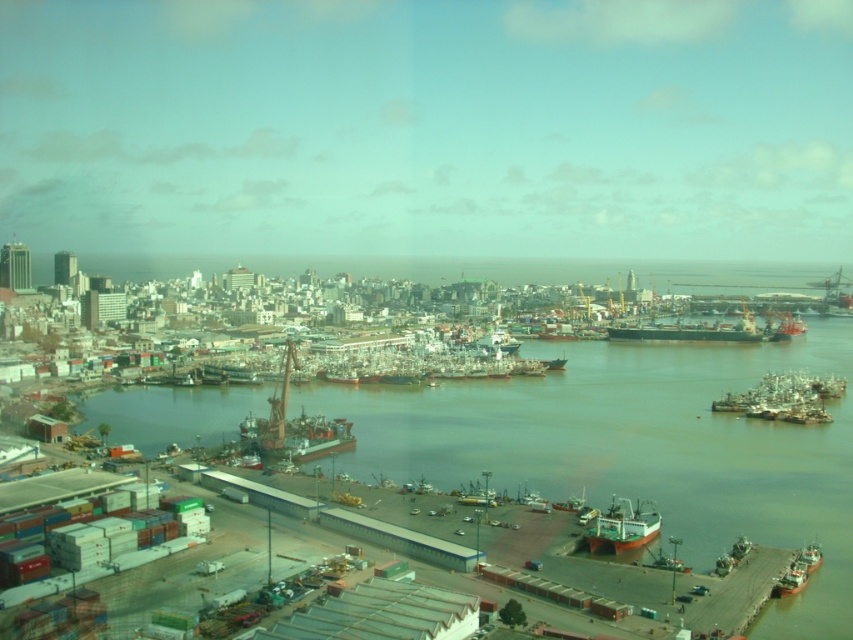
Who is more distant from viewer, (537, 452) or (769, 314)?

The point (769, 314) is more distant.

Does brown matte water at center have a greater width compared to reddish-orange wooden boat at center-right?

Yes, brown matte water at center is wider than reddish-orange wooden boat at center-right.

Is point (560, 445) closer to viewer compared to point (781, 330)?

Yes, point (560, 445) is in front of point (781, 330).

Identify the location of brown matte water at center. (639, 445).

Is brown matte ship at lower right shorter than orange matte boat at lower center?

No, brown matte ship at lower right is not shorter than orange matte boat at lower center.

Between brown matte ship at lower right and orange matte boat at lower center, which one appears on the right side from the viewer's perspective?

Positioned to the right is brown matte ship at lower right.

Does point (795, 579) lie behind point (566, 506)?

No, it is in front of (566, 506).

Locate an element on the screen. This screenshot has width=853, height=640. brown matte ship at lower right is located at coordinates (798, 572).

Who is higher up, brown matte water at center or orange matte ship at lower right?

Positioned higher is brown matte water at center.

Is brown matte water at center closer to the viewer compared to orange matte ship at lower right?

Yes, it is.

This screenshot has height=640, width=853. Find the location of `brown matte water at center`. brown matte water at center is located at coordinates (639, 445).